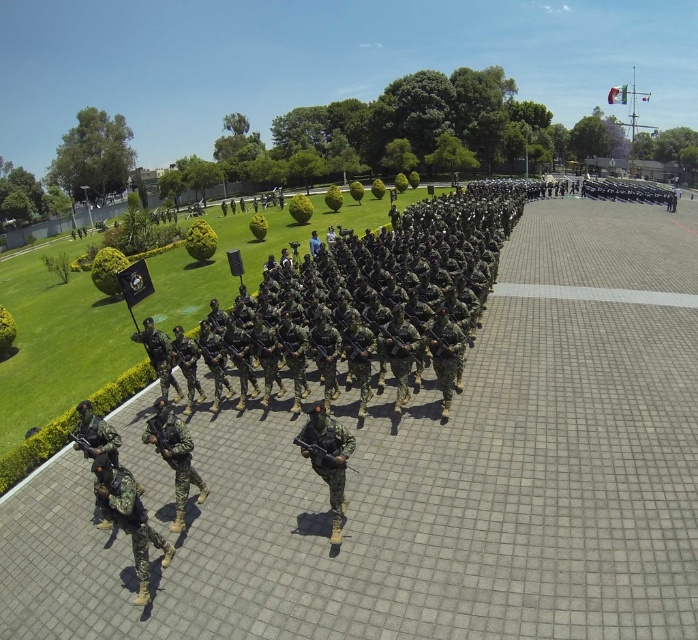
Between camouflage fabric uniform at lower left and camouflage uniform at center, which one appears on the left side from the viewer's perspective?

From the viewer's perspective, camouflage fabric uniform at lower left appears more on the left side.

Does camouflage fabric uniform at lower left appear under camouflage uniform at center?

Correct, camouflage fabric uniform at lower left is located below camouflage uniform at center.

Which is behind, point (158, 547) or point (341, 499)?

Point (341, 499)

What are the coordinates of `camouflage fabric uniform at lower left` in the screenshot? It's located at click(x=128, y=516).

At what (x,y) coordinates should I click in order to perform the action: click on camouflage fabric uniform at lower left. Please return your answer as a coordinate pair (x, y). Looking at the image, I should click on (128, 516).

What do you see at coordinates (128, 516) in the screenshot? The width and height of the screenshot is (698, 640). I see `camouflage fabric uniform at lower left` at bounding box center [128, 516].

At what (x,y) coordinates should I click in order to perform the action: click on camouflage fabric uniform at lower left. Please return your answer as a coordinate pair (x, y). Looking at the image, I should click on (128, 516).

Who is positioned more to the right, camouflage fabric uniform at lower left or camouflage fabric uniform at center?

camouflage fabric uniform at lower left is more to the right.

Between point (142, 593) and point (135, 336), which one is positioned in front?

Point (142, 593)

Does point (105, 477) lie behind point (165, 340)?

No, (105, 477) is closer to viewer.

Image resolution: width=698 pixels, height=640 pixels. What are the coordinates of `camouflage fabric uniform at lower left` in the screenshot? It's located at (128, 516).